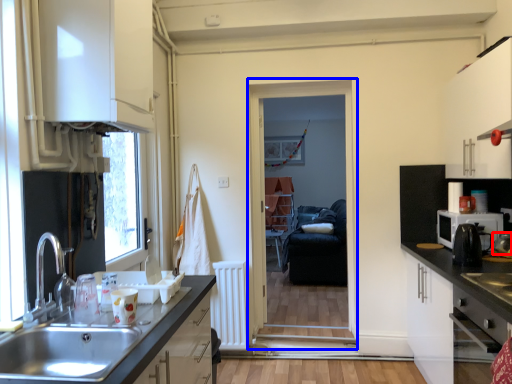
Question: Which of the following is the farthest to the observer, appliance (highlighted by a red box) or screen door (highlighted by a blue box)?

Choices:
 (A) appliance
 (B) screen door

Answer: (B)